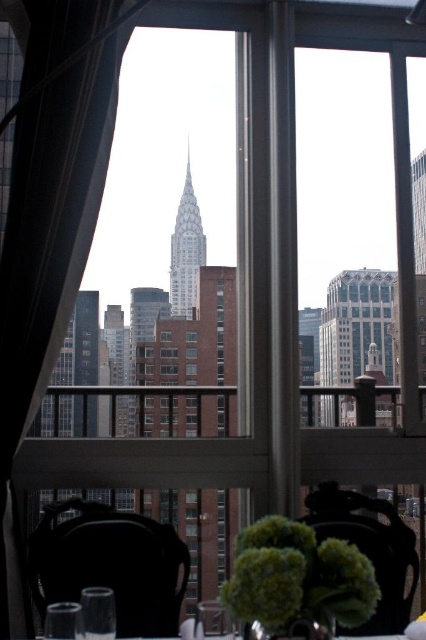
You are a guest at a dinner party and notice the clear glass wine glass at lower center and the clear glass table at center. Which object is taller?

The clear glass wine glass at lower center is taller than the clear glass table at center according to the description.

You are a guest at a dinner party and want to reach for the clear glass wine glass at lower center without disturbing the satin white curtain at left. Can you do so easily?

The satin white curtain at left is closer to the viewer than the clear glass wine glass at lower center, so you can reach the clear glass wine glass at lower center without moving the satin white curtain at left as it is behind the glass.

You are standing in the room looking out the window. There is a point marked at coordinates point (51, 204). What is the object at that point?

The point (51, 204) is located on the satin white curtain at left.